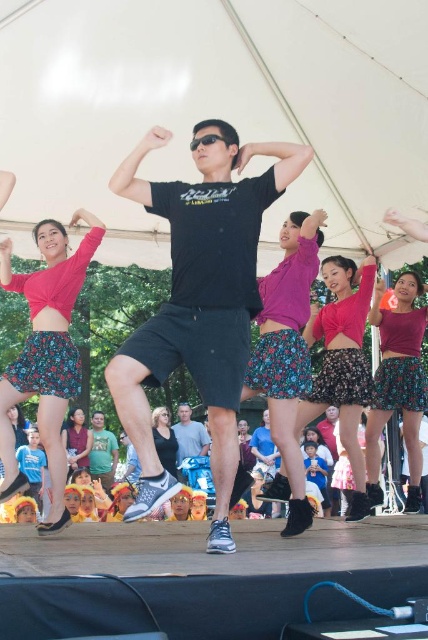
Question: Which of the following is the closest to the observer?

Choices:
 (A) black matte t-shirt at center
 (B) black leather shoes at lower center

Answer: (A)

Question: Is black matte t-shirt at center further to camera compared to black leather shoes at lower center?

Choices:
 (A) no
 (B) yes

Answer: (A)

Question: Can you confirm if black matte t-shirt at center is smaller than black leather shoes at lower center?

Choices:
 (A) yes
 (B) no

Answer: (B)

Question: Among these points, which one is farthest from the camera?

Choices:
 (A) (243, 468)
 (B) (238, 369)

Answer: (A)

Question: Is black matte t-shirt at center in front of black leather shoes at lower center?

Choices:
 (A) yes
 (B) no

Answer: (A)

Question: Which of the following is the closest to the observer?

Choices:
 (A) black matte t-shirt at center
 (B) black leather shoes at lower center

Answer: (A)